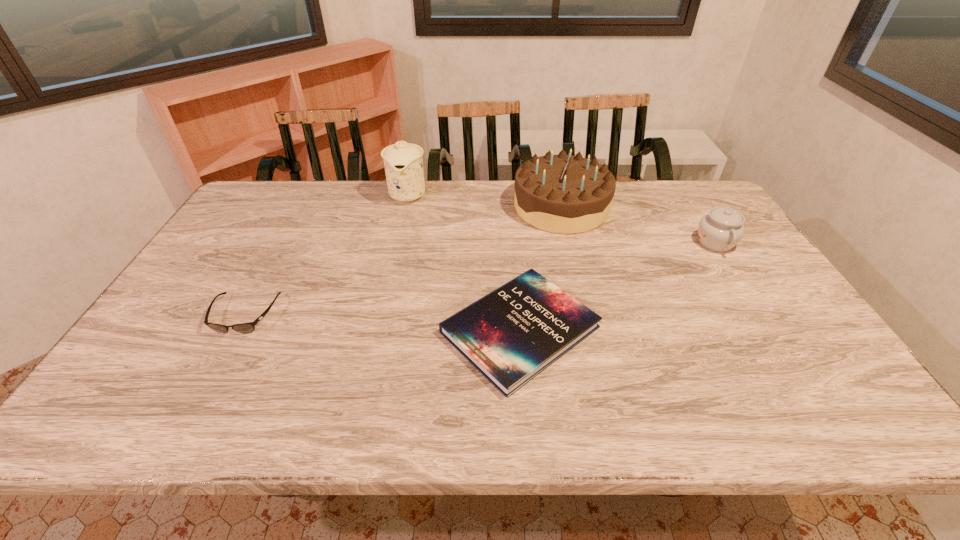
At what (x,y) coordinates should I click in order to perform the action: click on vacant space at the far edge. Please return your answer as a coordinate pair (x, y). Looking at the image, I should click on (321, 194).

I want to click on free spot at the near edge of the desktop, so click(390, 408).

Where is `vacant space at the far left corner of the desktop`? This screenshot has height=540, width=960. vacant space at the far left corner of the desktop is located at coordinates (263, 208).

The height and width of the screenshot is (540, 960). In order to click on free spot between the birthday cake and the hardback book in this screenshot , I will do `click(540, 268)`.

The width and height of the screenshot is (960, 540). Find the location of `vacant space in between the tallest object and the hardback book`. vacant space in between the tallest object and the hardback book is located at coordinates (464, 262).

Image resolution: width=960 pixels, height=540 pixels. Identify the location of free space between the birthday cake and the sunglasses. (403, 261).

Where is `unoccupied position between the nearer chinaware and the second shortest object`? The image size is (960, 540). unoccupied position between the nearer chinaware and the second shortest object is located at coordinates (480, 279).

Locate an element on the screen. This screenshot has height=540, width=960. free space between the shortest object and the farther chinaware is located at coordinates (464, 262).

The width and height of the screenshot is (960, 540). What are the coordinates of `unoccupied area between the fourth tallest object and the right chinaware` in the screenshot? It's located at (480, 279).

Locate an element on the screen. vacant point located between the fourth shortest object and the hardback book is located at coordinates (540, 268).